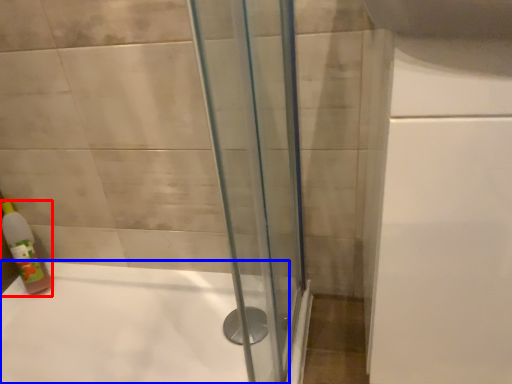
Question: Among these objects, which one is farthest to the camera, bottle (highlighted by a red box) or bathtub (highlighted by a blue box)?

Choices:
 (A) bottle
 (B) bathtub

Answer: (A)